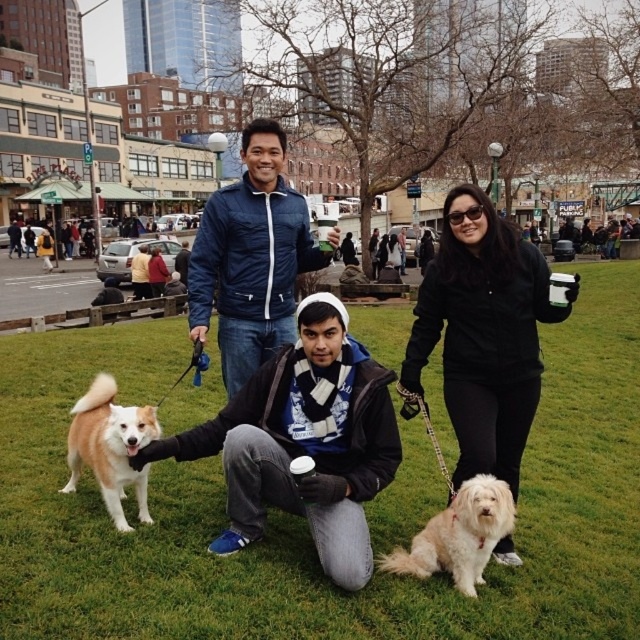
Question: Which of the following is the farthest from the observer?

Choices:
 (A) green grass at center
 (B) light brown fur dog at center
 (C) fluffy white dog at center

Answer: (B)

Question: Is matte blue jacket at center below white fluffy dog at lower center?

Choices:
 (A) no
 (B) yes

Answer: (A)

Question: Which object is the closest to the green grass at center?

Choices:
 (A) matte blue jacket at center
 (B) light brown fur dog at center
 (C) fluffy white dog at center
 (D) white fluffy dog at lower center

Answer: (C)

Question: Estimate the real-world distances between objects in this image. Which object is closer to the light brown fur dog at center?

Choices:
 (A) white fluffy dog at lower center
 (B) black matte jacket at center
 (C) matte blue jacket at center

Answer: (C)

Question: Can you confirm if matte blue jacket at center is positioned above white fluffy dog at lower center?

Choices:
 (A) no
 (B) yes

Answer: (B)

Question: Can you confirm if green grass at center is positioned above black matte jacket at center?

Choices:
 (A) yes
 (B) no

Answer: (B)